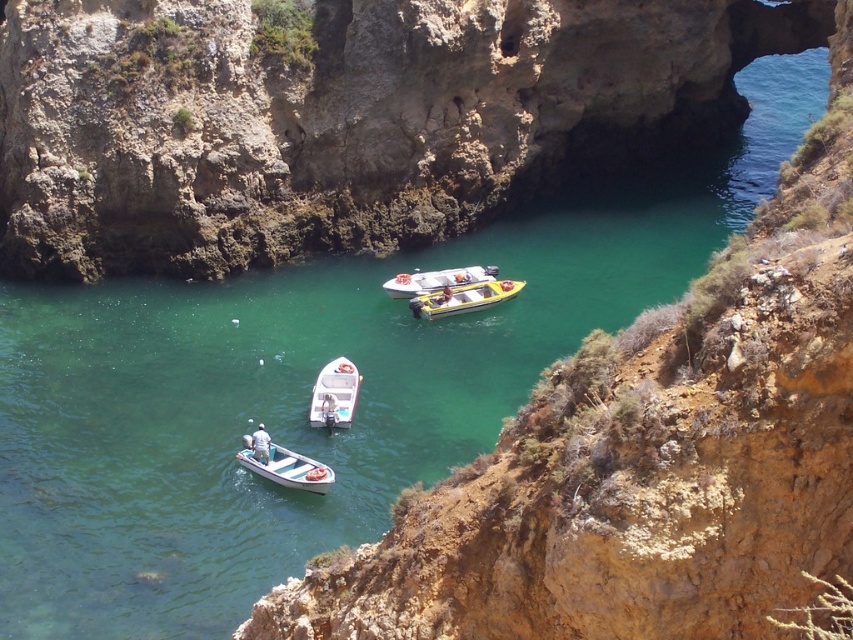
Question: Which object is positioned closest to the yellow plastic boat at center?

Choices:
 (A) white fabric shirt at lower center
 (B) yellow rubber boat at center
 (C) white plastic boat at center
 (D) clear water at center

Answer: (B)

Question: Is yellow rubber boat at center closer to the viewer compared to yellow plastic boat at center?

Choices:
 (A) yes
 (B) no

Answer: (A)

Question: Observing the image, what is the correct spatial positioning of clear water at center in reference to white plastic boat at lower center?

Choices:
 (A) above
 (B) below

Answer: (A)

Question: Considering the real-world distances, which object is closest to the white plastic boat at lower center?

Choices:
 (A) white fabric shirt at lower center
 (B) white plastic boat at center
 (C) yellow rubber boat at center
 (D) yellow plastic boat at center

Answer: (A)

Question: Does clear water at center have a greater width compared to white plastic boat at center?

Choices:
 (A) no
 (B) yes

Answer: (B)

Question: Which point is closer to the camera?

Choices:
 (A) white plastic boat at center
 (B) yellow plastic boat at center
 (C) yellow rubber boat at center

Answer: (A)